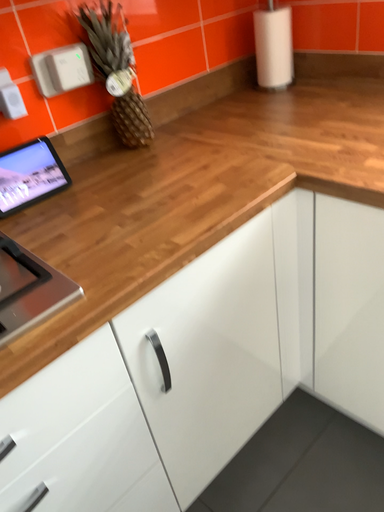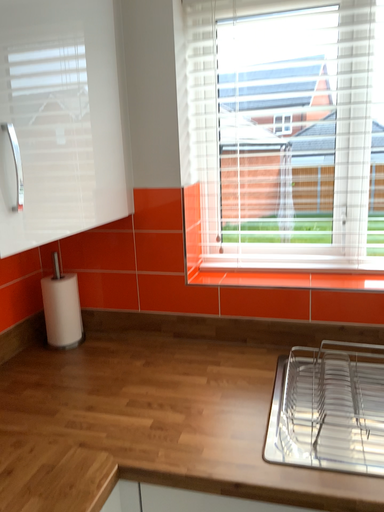
Question: How did the camera likely rotate when shooting the video?

Choices:
 (A) rotated left
 (B) rotated right

Answer: (B)